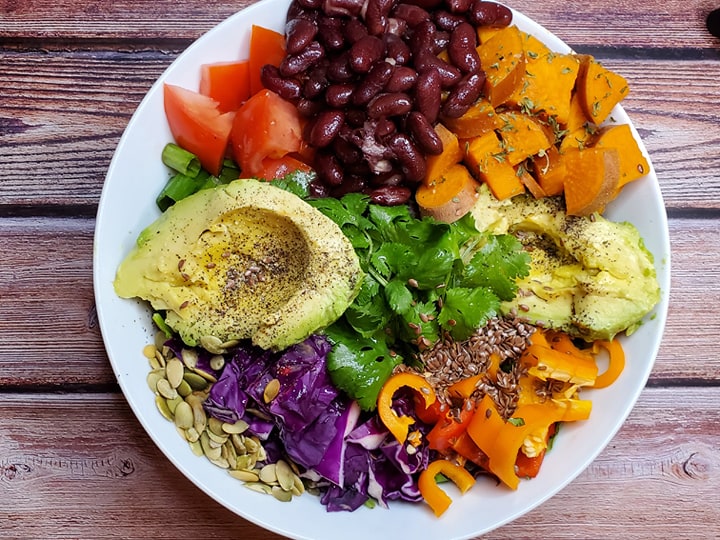
Locate an element on the screen. plate is located at coordinates (134, 217).